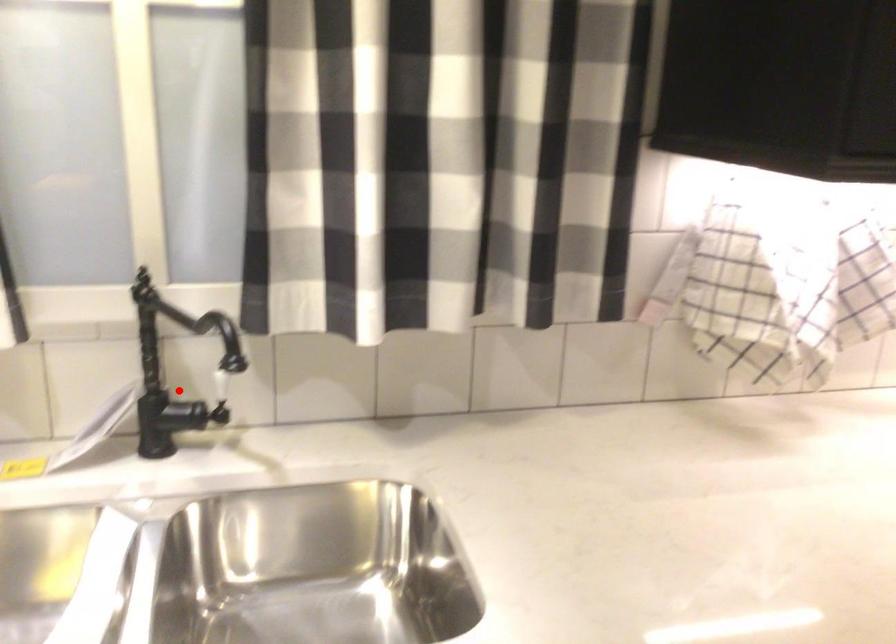
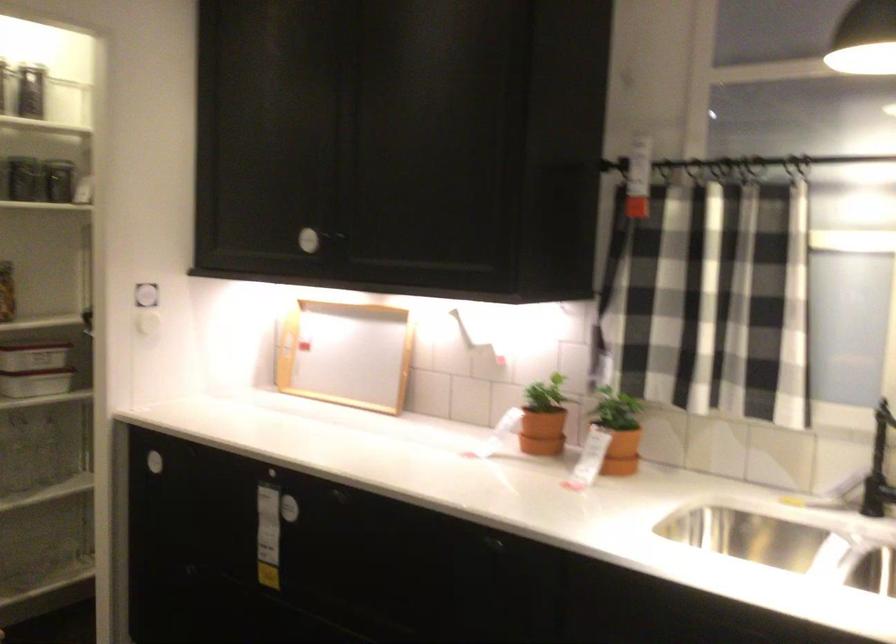
The point at the highlighted location is marked in the first image. Where is the corresponding point in the second image?

(879, 468)